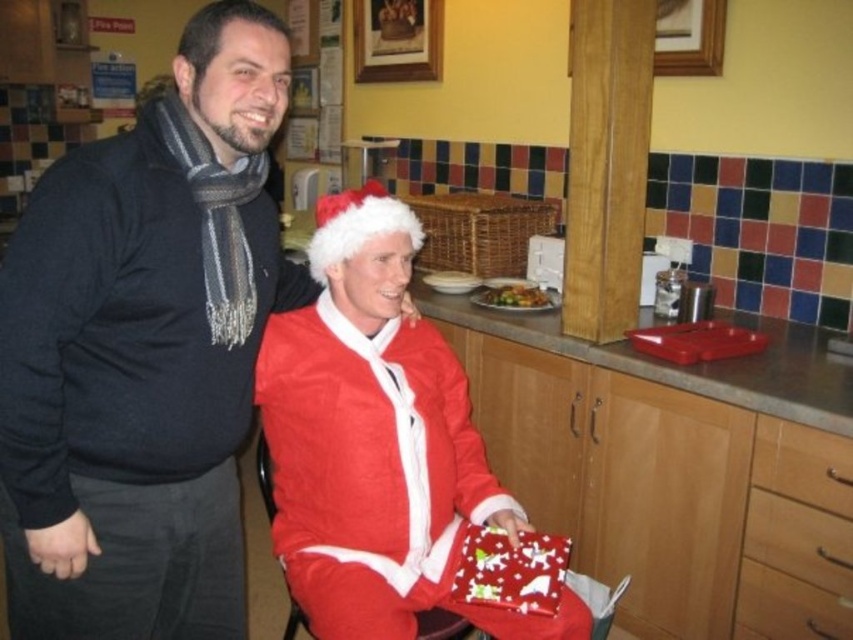
Is point (22, 632) less distant than point (525, 285)?

Yes, it is in front of point (525, 285).

Consider the image. Between matte red santa suit at center and golden brown crispy chicken at center, which one is positioned lower?

matte red santa suit at center is lower down.

The width and height of the screenshot is (853, 640). Describe the element at coordinates (144, 352) in the screenshot. I see `matte red santa suit at center` at that location.

I want to click on matte red santa suit at center, so click(x=144, y=352).

Could you measure the distance between shiny red wrapping paper at lower center and golden brown crispy chicken at center?

1.09 meters

Does shiny red wrapping paper at lower center have a smaller size compared to golden brown crispy chicken at center?

Incorrect, shiny red wrapping paper at lower center is not smaller in size than golden brown crispy chicken at center.

The width and height of the screenshot is (853, 640). Find the location of `shiny red wrapping paper at lower center`. shiny red wrapping paper at lower center is located at coordinates (511, 570).

Is fuzzy red santa suit at center shorter than golden brown crispy chicken at center?

In fact, fuzzy red santa suit at center may be taller than golden brown crispy chicken at center.

Which is above, fuzzy red santa suit at center or golden brown crispy chicken at center?

→ golden brown crispy chicken at center is above.

The width and height of the screenshot is (853, 640). I want to click on fuzzy red santa suit at center, so click(376, 444).